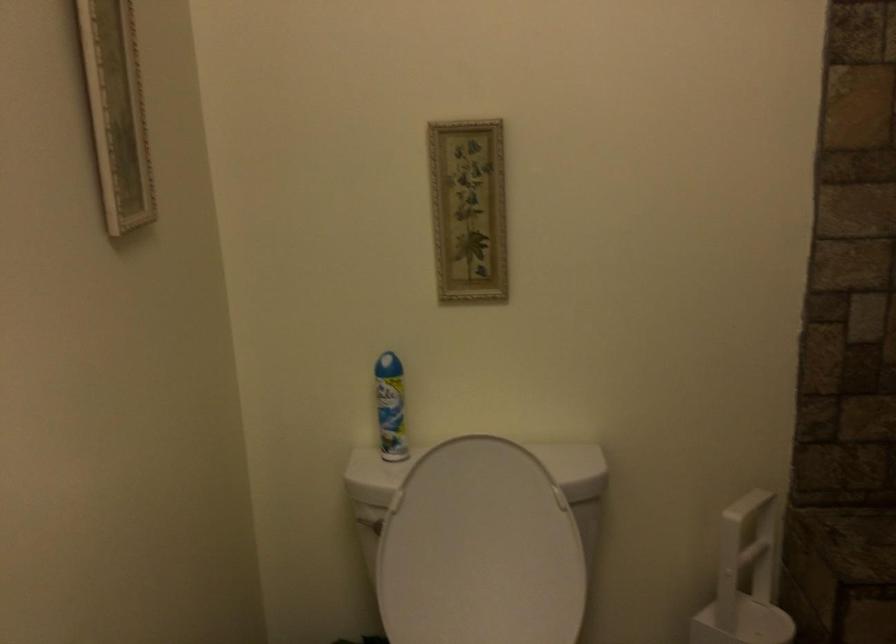
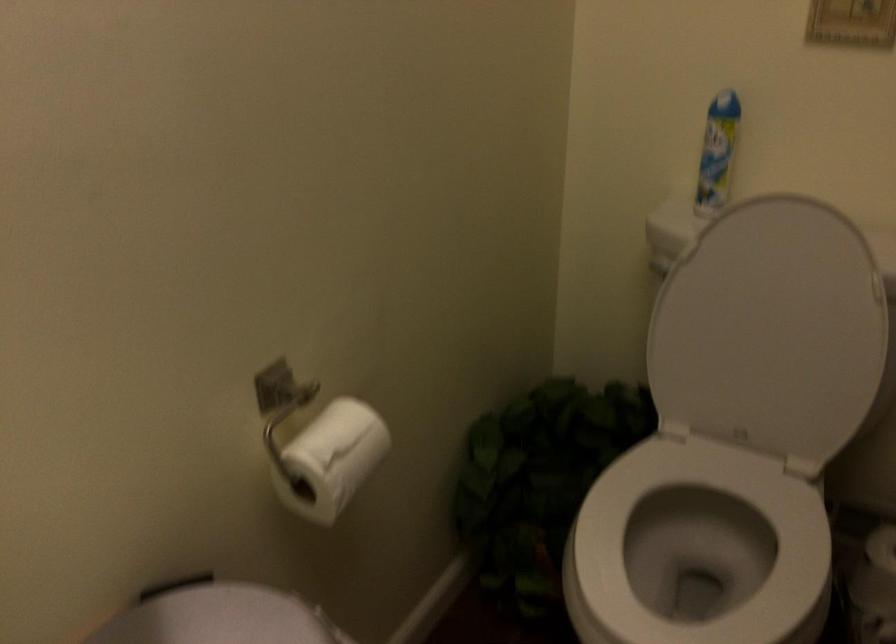
Where in the second image is the point corresponding to pixel 392 352 from the first image?

(729, 96)